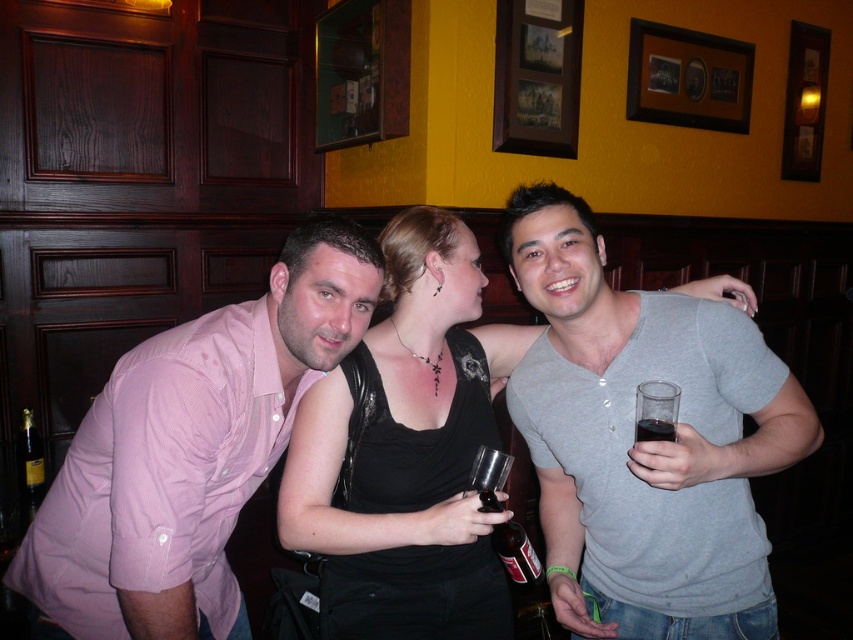
Question: Among these objects, which one is nearest to the camera?

Choices:
 (A) gold foil champagne bottle at lower left
 (B) dark glass at right
 (C) clear glass bottle at center

Answer: (B)

Question: Is gray cotton shirt at right to the left of gold foil champagne bottle at lower left from the viewer's perspective?

Choices:
 (A) no
 (B) yes

Answer: (A)

Question: Where is black matte tank top at center located in relation to clear glass bottle at center in the image?

Choices:
 (A) above
 (B) below

Answer: (A)

Question: Which point is closer to the camera taking this photo?

Choices:
 (A) (26, 442)
 (B) (607, 461)
 (C) (80, 598)
 (D) (486, 500)

Answer: (C)

Question: Can you confirm if clear glass bottle at center is positioned to the left of gold foil champagne bottle at lower left?

Choices:
 (A) no
 (B) yes

Answer: (A)

Question: Which point appears farthest from the camera in this image?

Choices:
 (A) (675, 432)
 (B) (498, 548)

Answer: (B)